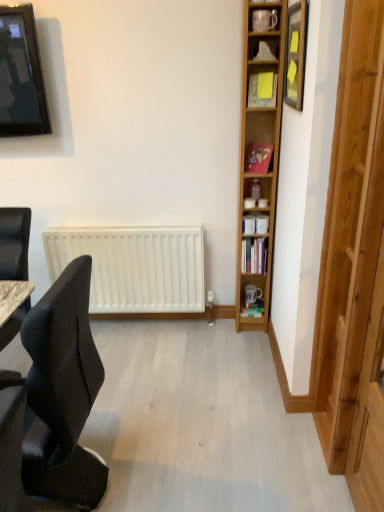
Question: Is transparent wooden door at right next to black fabric chair at left?

Choices:
 (A) yes
 (B) no

Answer: (B)

Question: Considering the relative positions of transparent wooden door at right and black fabric chair at left in the image provided, is transparent wooden door at right to the right of black fabric chair at left from the viewer's perspective?

Choices:
 (A) no
 (B) yes

Answer: (B)

Question: Is transparent wooden door at right bigger than black fabric chair at left?

Choices:
 (A) yes
 (B) no

Answer: (A)

Question: From the image's perspective, is transparent wooden door at right beneath black fabric chair at left?

Choices:
 (A) yes
 (B) no

Answer: (B)

Question: Does transparent wooden door at right have a smaller size compared to black fabric chair at left?

Choices:
 (A) no
 (B) yes

Answer: (A)

Question: From the image's perspective, is wooden picture frame at upper right located above or below matte black television at upper left?

Choices:
 (A) above
 (B) below

Answer: (B)

Question: Considering the positions of point (286, 25) and point (21, 14), is point (286, 25) closer or farther from the camera than point (21, 14)?

Choices:
 (A) closer
 (B) farther

Answer: (A)

Question: In terms of width, does wooden picture frame at upper right look wider or thinner when compared to matte black television at upper left?

Choices:
 (A) wide
 (B) thin

Answer: (B)

Question: Looking at the image, does wooden picture frame at upper right seem bigger or smaller compared to matte black television at upper left?

Choices:
 (A) big
 (B) small

Answer: (B)

Question: In the image, is yellow paper at upper center positioned in front of or behind hardcover book at center?

Choices:
 (A) front
 (B) behind

Answer: (A)

Question: In terms of size, does yellow paper at upper center appear bigger or smaller than hardcover book at center?

Choices:
 (A) small
 (B) big

Answer: (B)

Question: Looking at their shapes, would you say yellow paper at upper center is wider or thinner than hardcover book at center?

Choices:
 (A) thin
 (B) wide

Answer: (B)

Question: Is yellow paper at upper center spatially inside hardcover book at center, or outside of it?

Choices:
 (A) outside
 (B) inside

Answer: (A)

Question: From their relative heights in the image, would you say hardcover book at center is taller or shorter than matte black television at upper left?

Choices:
 (A) tall
 (B) short

Answer: (B)

Question: Considering the positions of hardcover book at center and matte black television at upper left in the image, is hardcover book at center bigger or smaller than matte black television at upper left?

Choices:
 (A) small
 (B) big

Answer: (A)